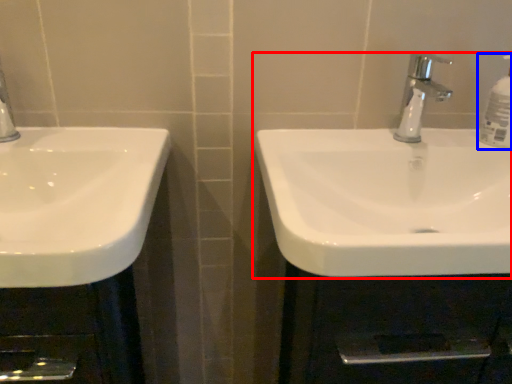
Question: Which of the following is the farthest to the observer, sink (highlighted by a red box) or soap dispenser (highlighted by a blue box)?

Choices:
 (A) sink
 (B) soap dispenser

Answer: (B)